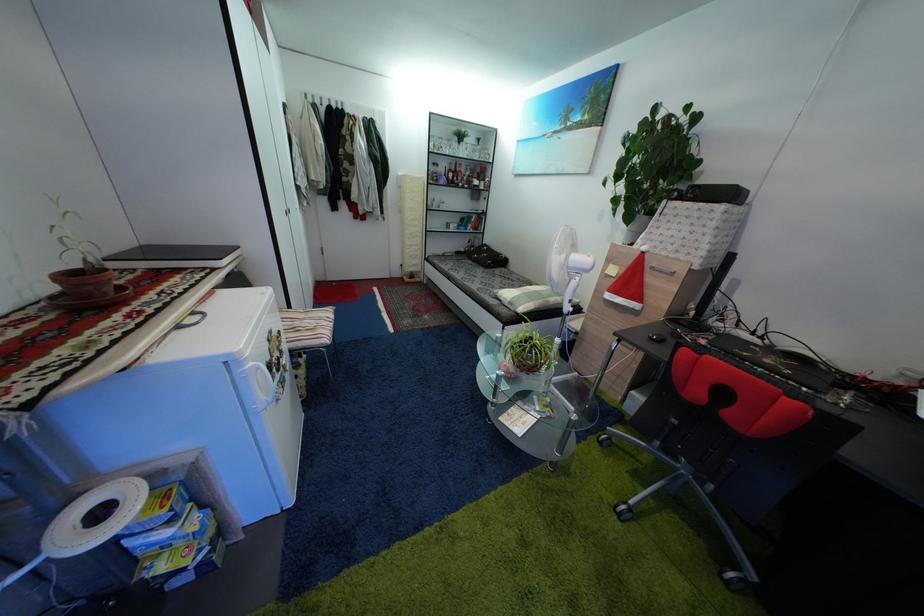
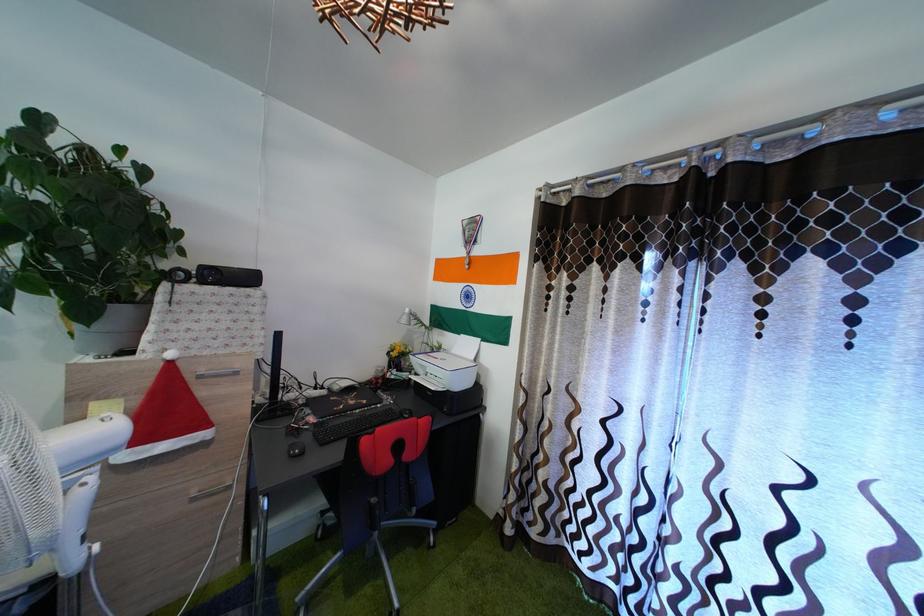
Locate, in the second image, the point that corresponds to the point at 676,345 in the first image.

(304, 448)